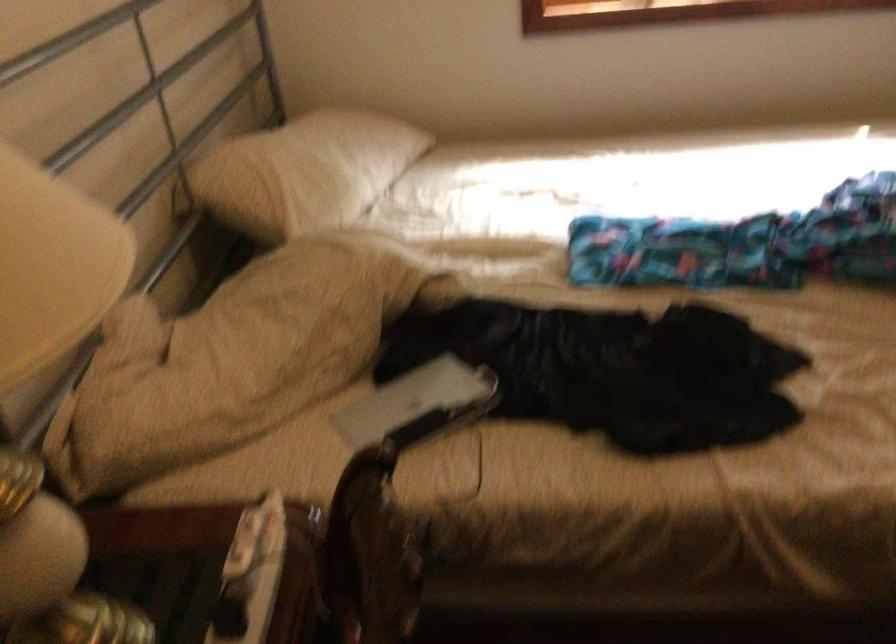
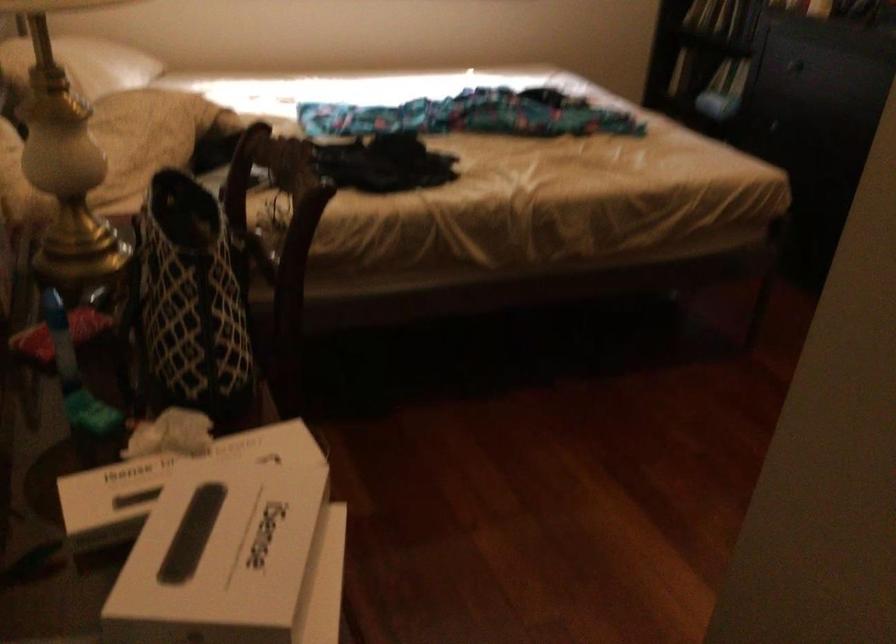
Question: Based on the continuous images, in which direction is the camera rotating? Reply with the corresponding letter.

Choices:
 (A) Left
 (B) Right
 (C) Up
 (D) Down

Answer: (B)